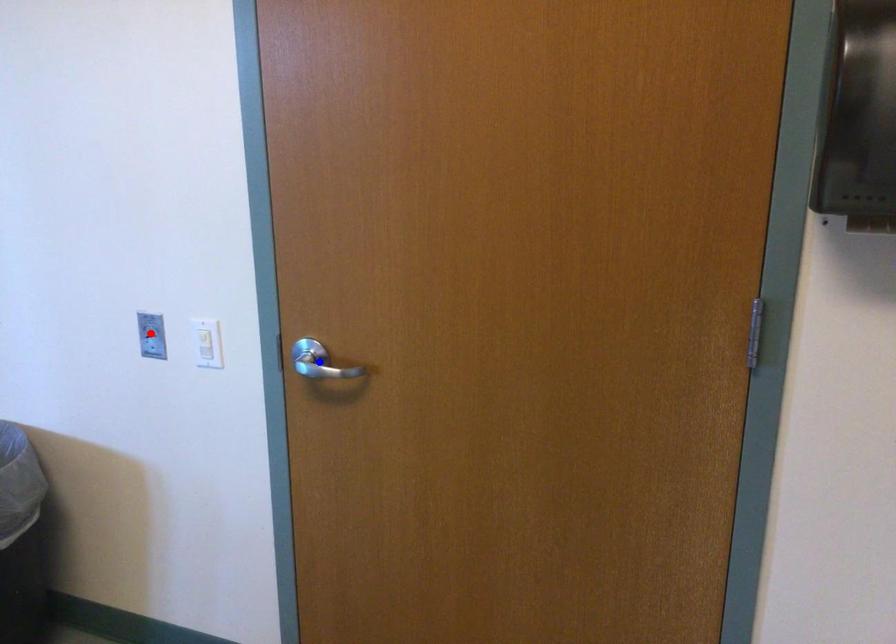
Question: Which of the two points in the image is closer to the camera?

Choices:
 (A) Blue point is closer.
 (B) Red point is closer.

Answer: (A)